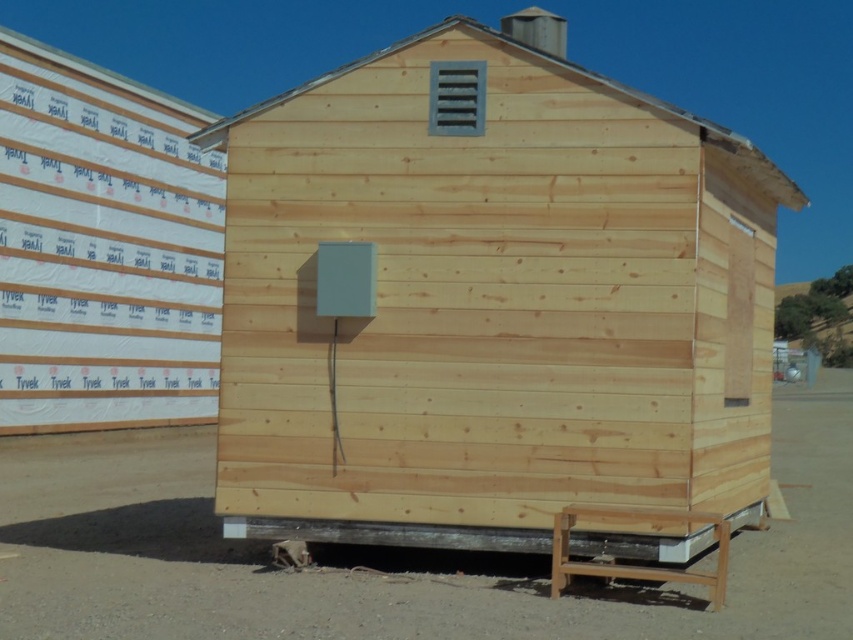
You are a construction worker standing at the edge of the dirt field at lower center. You need to place a ladder against the natural wood cabin at center. Can you safely lean the ladder against the cabin without it extending above the cabin?

The natural wood cabin at center is not as tall as dirt field at lower center. Since the dirt field is taller, the ladder can be safely leaned against the cabin without extending above it.

You are a construction worker standing at the base of the natural wood cabin at center. You need to inspect the white tyvek siding at upper left. Which direction should you move to reach it?

The natural wood cabin at center is below the white tyvek siding at upper left, so you should move upward to reach the white tyvek siding at upper left.